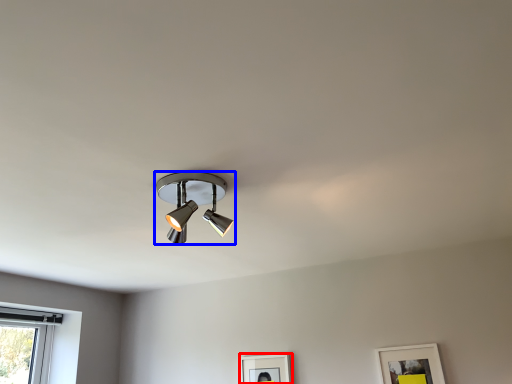
Question: Which object appears closest to the camera in this image, picture frame (highlighted by a red box) or lamp (highlighted by a blue box)?

Choices:
 (A) picture frame
 (B) lamp

Answer: (B)